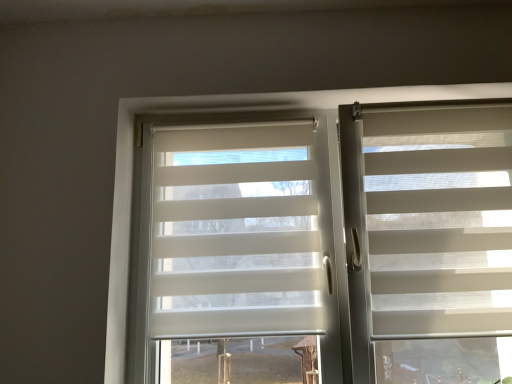
Question: Is white translucent blinds at center to the left of white textured blind at right from the viewer's perspective?

Choices:
 (A) no
 (B) yes

Answer: (B)

Question: From the image's perspective, is white translucent blinds at center located above white textured blind at right?

Choices:
 (A) yes
 (B) no

Answer: (B)

Question: Is white translucent blinds at center outside white textured blind at right?

Choices:
 (A) no
 (B) yes

Answer: (B)

Question: Is white translucent blinds at center not near white textured blind at right?

Choices:
 (A) yes
 (B) no

Answer: (B)

Question: Is the depth of white translucent blinds at center greater than that of white textured blind at right?

Choices:
 (A) no
 (B) yes

Answer: (B)

Question: Is white translucent blinds at center thinner than white textured blind at right?

Choices:
 (A) yes
 (B) no

Answer: (B)

Question: Is white textured blind at right behind white translucent roller shade at center?

Choices:
 (A) yes
 (B) no

Answer: (B)

Question: From the image's perspective, is white textured blind at right on white translucent roller shade at center?

Choices:
 (A) yes
 (B) no

Answer: (A)

Question: From a real-world perspective, is white textured blind at right located beneath white translucent roller shade at center?

Choices:
 (A) no
 (B) yes

Answer: (B)

Question: Would you consider white textured blind at right to be distant from white translucent roller shade at center?

Choices:
 (A) yes
 (B) no

Answer: (B)

Question: Can you confirm if white textured blind at right is taller than white translucent roller shade at center?

Choices:
 (A) yes
 (B) no

Answer: (A)

Question: Is white textured blind at right turned away from white translucent roller shade at center?

Choices:
 (A) yes
 (B) no

Answer: (B)

Question: Is white textured blind at right at the right side of white translucent blinds at center?

Choices:
 (A) yes
 (B) no

Answer: (A)